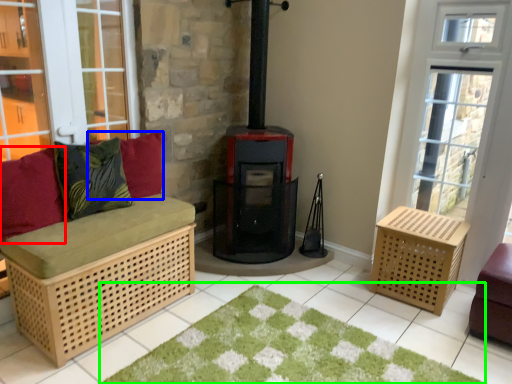
Question: Estimate the real-world distances between objects in this image. Which object is farther from pillow (highlighted by a red box), pillow (highlighted by a blue box) or doormat (highlighted by a green box)?

Choices:
 (A) pillow
 (B) doormat

Answer: (B)